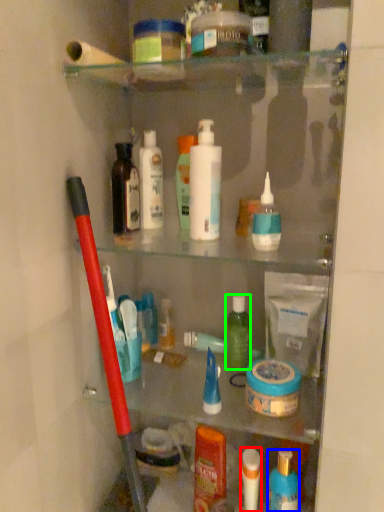
Question: Based on their relative distances, which object is nearer to toiletry (highlighted by a red box)? Choose from toiletry (highlighted by a blue box) and toiletry (highlighted by a green box).

Choices:
 (A) toiletry
 (B) toiletry

Answer: (A)